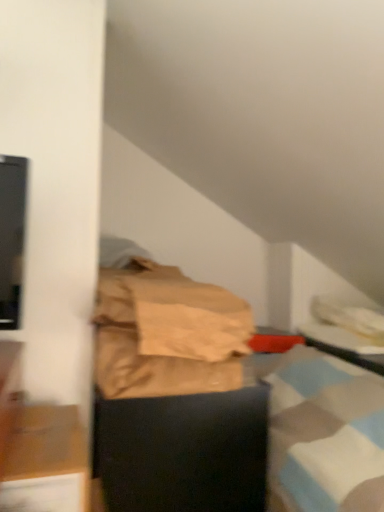
The height and width of the screenshot is (512, 384). What do you see at coordinates (166, 333) in the screenshot?
I see `brown paper bag at center` at bounding box center [166, 333].

You are a GUI agent. You are given a task and a screenshot of the screen. Output one action in this format:
    pyautogui.click(x=<x>, y=<y>)
    Task: Click on the wooden cabinet at lower left, marked as the 2th furniture in a back-to-front arrangement
    This screenshot has height=512, width=384.
    Given the screenshot: What is the action you would take?
    pyautogui.click(x=46, y=462)

Consider the image. Which of these two, black matte box at center, placed as the 2th furniture when sorted from front to back, or black glossy table at right, is bigger?

Bigger between the two is black matte box at center, placed as the 2th furniture when sorted from front to back.

Is black matte box at center, positioned as the 1th furniture in back-to-front order, next to black glossy table at right and touching it?

No.

Which object is thinner, black matte box at center, positioned as the 1th furniture in back-to-front order, or black glossy table at right?

black glossy table at right is thinner.

Starting from the black glossy table at right, which furniture is the 1st one in front? Please provide its 2D coordinates.

[(183, 452)]

Between black glossy table at right and wooden cabinet at lower left, marked as the 2th furniture in a back-to-front arrangement, which one is positioned behind?

black glossy table at right.

Which point is more distant from viewer, (335, 339) or (80, 486)?

Positioned behind is point (335, 339).

Looking at this image, between black glossy table at right and wooden cabinet at lower left, which appears as the first furniture when viewed from the front, which one has smaller size?

wooden cabinet at lower left, which appears as the first furniture when viewed from the front, is smaller.

In terms of width, does black glossy table at right look wider or thinner when compared to wooden cabinet at lower left, marked as the 2th furniture in a back-to-front arrangement?

black glossy table at right is wider than wooden cabinet at lower left, marked as the 2th furniture in a back-to-front arrangement.

Looking at this image, which of these two, wooden cabinet at lower left, which appears as the first furniture when viewed from the front, or brown paper bag at center, is thinner?

wooden cabinet at lower left, which appears as the first furniture when viewed from the front, is thinner.

From a real-world perspective, between wooden cabinet at lower left, which appears as the first furniture when viewed from the front, and brown paper bag at center, who is vertically lower?

wooden cabinet at lower left, which appears as the first furniture when viewed from the front, is physically lower.

Considering the relative positions of wooden cabinet at lower left, marked as the 2th furniture in a back-to-front arrangement, and brown paper bag at center in the image provided, is wooden cabinet at lower left, marked as the 2th furniture in a back-to-front arrangement, behind brown paper bag at center?

No, the depth of wooden cabinet at lower left, marked as the 2th furniture in a back-to-front arrangement, is less than that of brown paper bag at center.

Is brown paper bag at center in contact with wooden cabinet at lower left, which appears as the first furniture when viewed from the front?

There is a gap between brown paper bag at center and wooden cabinet at lower left, which appears as the first furniture when viewed from the front.

At what (x,y) coordinates should I click in order to perform the action: click on material that appears on the right of wooden cabinet at lower left, which appears as the first furniture when viewed from the front. Please return your answer as a coordinate pair (x, y). Image resolution: width=384 pixels, height=512 pixels. Looking at the image, I should click on (166, 333).

Does brown paper bag at center lie behind wooden cabinet at lower left, marked as the 2th furniture in a back-to-front arrangement?

Yes, it is.

Could you tell me if brown paper bag at center is facing black matte box at center, placed as the 2th furniture when sorted from front to back?

No, brown paper bag at center is not facing towards black matte box at center, placed as the 2th furniture when sorted from front to back.

Based on their sizes in the image, would you say brown paper bag at center is bigger or smaller than black matte box at center, placed as the 2th furniture when sorted from front to back?

In the image, brown paper bag at center appears to be smaller than black matte box at center, placed as the 2th furniture when sorted from front to back.

Considering the positions of objects brown paper bag at center and black matte box at center, positioned as the 1th furniture in back-to-front order, in the image provided, who is in front, brown paper bag at center or black matte box at center, positioned as the 1th furniture in back-to-front order,?

brown paper bag at center.

From the image's perspective, which one is positioned higher, black glossy table at right or black matte box at center, placed as the 2th furniture when sorted from front to back?

black glossy table at right, from the image's perspective.

Would you say black glossy table at right is inside or outside black matte box at center, positioned as the 1th furniture in back-to-front order?

black glossy table at right lies outside black matte box at center, positioned as the 1th furniture in back-to-front order.

Which of these two, black glossy table at right or black matte box at center, placed as the 2th furniture when sorted from front to back, is thinner?

black glossy table at right.

In the scene shown: From a real-world perspective, between black glossy table at right and black matte box at center, placed as the 2th furniture when sorted from front to back, who is vertically lower?

black matte box at center, placed as the 2th furniture when sorted from front to back.

Considering the relative positions of wooden cabinet at lower left, marked as the 2th furniture in a back-to-front arrangement, and black glossy table at right in the image provided, is wooden cabinet at lower left, marked as the 2th furniture in a back-to-front arrangement, to the left of black glossy table at right from the viewer's perspective?

Correct, you'll find wooden cabinet at lower left, marked as the 2th furniture in a back-to-front arrangement, to the left of black glossy table at right.

Is wooden cabinet at lower left, marked as the 2th furniture in a back-to-front arrangement, positioned with its back to black glossy table at right?

wooden cabinet at lower left, marked as the 2th furniture in a back-to-front arrangement, is not turned away from black glossy table at right.

Is wooden cabinet at lower left, which appears as the first furniture when viewed from the front, bigger than black glossy table at right?

Incorrect, wooden cabinet at lower left, which appears as the first furniture when viewed from the front, is not larger than black glossy table at right.

Where is `furniture that is the 1st one when counting leftward from the black glossy table at right`? The width and height of the screenshot is (384, 512). furniture that is the 1st one when counting leftward from the black glossy table at right is located at coordinates (183, 452).

Find the location of a particular element. The width and height of the screenshot is (384, 512). table behind the wooden cabinet at lower left, marked as the 2th furniture in a back-to-front arrangement is located at coordinates (344, 345).

Considering their positions, is black glossy table at right positioned further to brown paper bag at center than wooden cabinet at lower left, which appears as the first furniture when viewed from the front?

black glossy table at right is positioned further to the anchor brown paper bag at center.

Looking at the image, which one is located further to wooden cabinet at lower left, marked as the 2th furniture in a back-to-front arrangement, black glossy table at right or brown paper bag at center?

The object further to wooden cabinet at lower left, marked as the 2th furniture in a back-to-front arrangement, is black glossy table at right.

Looking at the image, which one is located further to black glossy table at right, black matte box at center, placed as the 2th furniture when sorted from front to back, or wooden cabinet at lower left, which appears as the first furniture when viewed from the front?

wooden cabinet at lower left, which appears as the first furniture when viewed from the front, lies further to black glossy table at right than the other object.

Based on their spatial positions, is wooden cabinet at lower left, marked as the 2th furniture in a back-to-front arrangement, or brown paper bag at center further from black glossy table at right?

wooden cabinet at lower left, marked as the 2th furniture in a back-to-front arrangement, is further to black glossy table at right.

Which object lies further to the anchor point black matte box at center, placed as the 2th furniture when sorted from front to back, wooden cabinet at lower left, which appears as the first furniture when viewed from the front, or black glossy table at right?

black glossy table at right.

Consider the image. Considering their positions, is black matte box at center, placed as the 2th furniture when sorted from front to back, positioned closer to brown paper bag at center than wooden cabinet at lower left, marked as the 2th furniture in a back-to-front arrangement?

black matte box at center, placed as the 2th furniture when sorted from front to back, lies closer to brown paper bag at center than the other object.

Based on their spatial positions, is brown paper bag at center or black matte box at center, positioned as the 1th furniture in back-to-front order, further from wooden cabinet at lower left, marked as the 2th furniture in a back-to-front arrangement?

black matte box at center, positioned as the 1th furniture in back-to-front order, is positioned further to the anchor wooden cabinet at lower left, marked as the 2th furniture in a back-to-front arrangement.

Considering their positions, is wooden cabinet at lower left, which appears as the first furniture when viewed from the front, positioned further to black matte box at center, positioned as the 1th furniture in back-to-front order, than brown paper bag at center?

Among the two, wooden cabinet at lower left, which appears as the first furniture when viewed from the front, is located further to black matte box at center, positioned as the 1th furniture in back-to-front order.

Locate an element on the screen. The height and width of the screenshot is (512, 384). furniture situated between wooden cabinet at lower left, marked as the 2th furniture in a back-to-front arrangement, and black glossy table at right from left to right is located at coordinates [183, 452].

At what (x,y) coordinates should I click in order to perform the action: click on material between wooden cabinet at lower left, which appears as the first furniture when viewed from the front, and black glossy table at right from left to right. Please return your answer as a coordinate pair (x, y). The image size is (384, 512). Looking at the image, I should click on (166, 333).

The height and width of the screenshot is (512, 384). I want to click on material situated between black matte box at center, placed as the 2th furniture when sorted from front to back, and black glossy table at right from left to right, so click(166, 333).

What are the coordinates of `furniture between brown paper bag at center and black matte box at center, positioned as the 1th furniture in back-to-front order, in the up-down direction` in the screenshot? It's located at (46, 462).